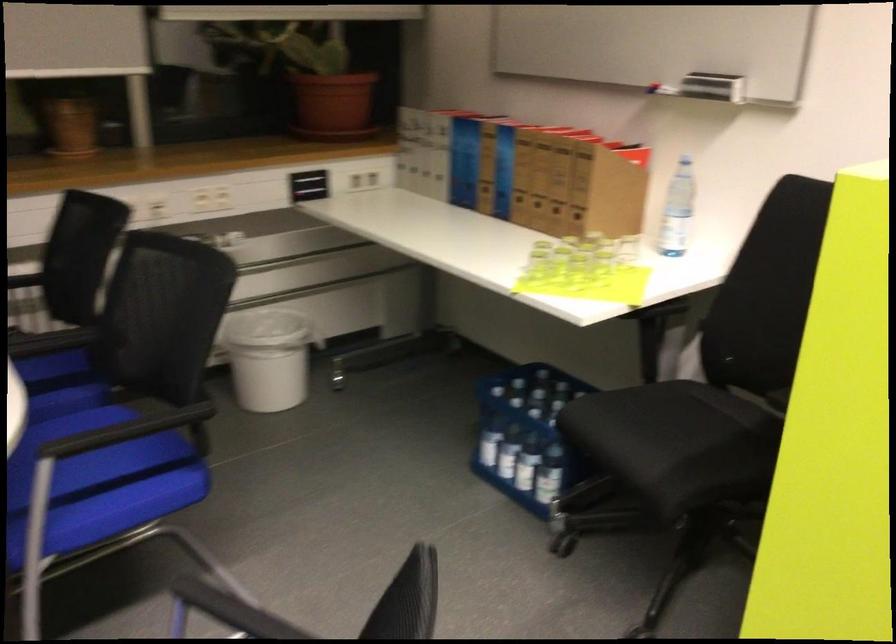
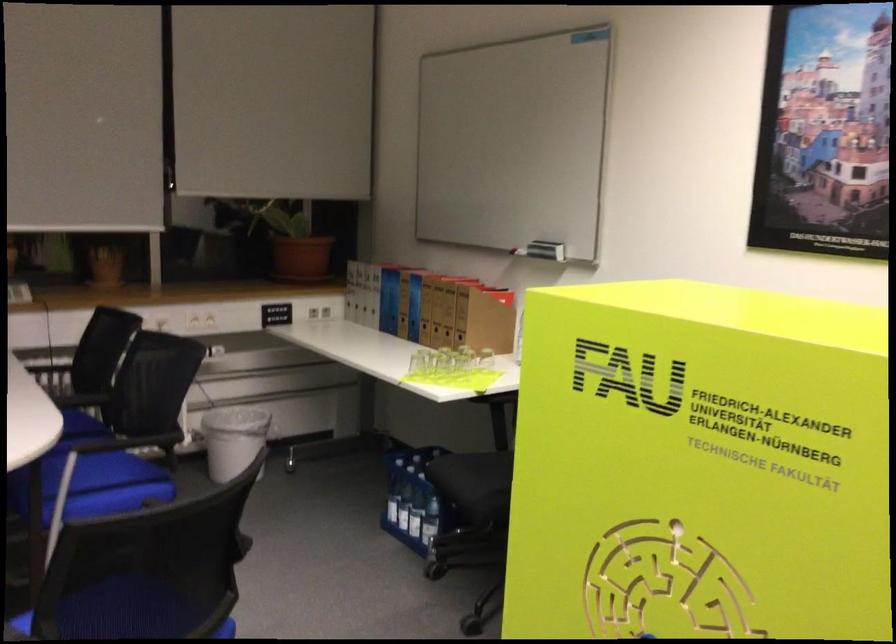
The point at (268, 355) is marked in the first image. Where is the corresponding point in the second image?

(234, 440)